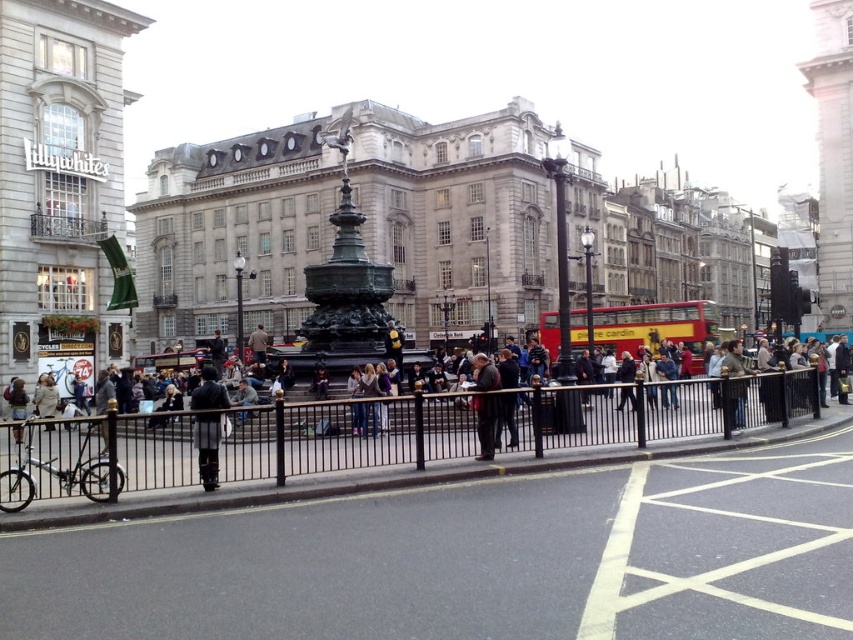
Question: Among these points, which one is farthest from the camera?

Choices:
 (A) (633, 353)
 (B) (201, 476)
 (C) (347, 413)

Answer: (A)

Question: Can you confirm if dark gray fabric coat at center is smaller than dark gray suit at center?

Choices:
 (A) no
 (B) yes

Answer: (A)

Question: Which is nearer to the dark gray fabric coat at center?

Choices:
 (A) red/yellow double-decker bus at center
 (B) dark gray suit at center

Answer: (B)

Question: Where is red/yellow double-decker bus at center located in relation to dark gray suit at center in the image?

Choices:
 (A) right
 (B) left

Answer: (A)

Question: Which object appears farthest from the camera in this image?

Choices:
 (A) black metal fence at lower center
 (B) dark gray suit at center
 (C) red/yellow double-decker bus at center
 (D) dark gray fabric coat at center

Answer: (C)

Question: Is black metal fence at lower center further to camera compared to red/yellow double-decker bus at center?

Choices:
 (A) no
 (B) yes

Answer: (A)